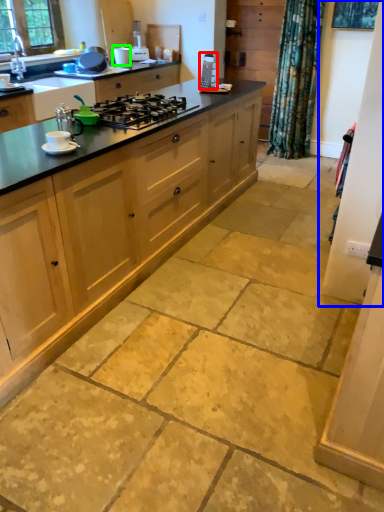
Question: Considering the real-world distances, which object is farthest from appliance (highlighted by a red box)? screen door (highlighted by a blue box) or appliance (highlighted by a green box)?

Choices:
 (A) screen door
 (B) appliance

Answer: (A)